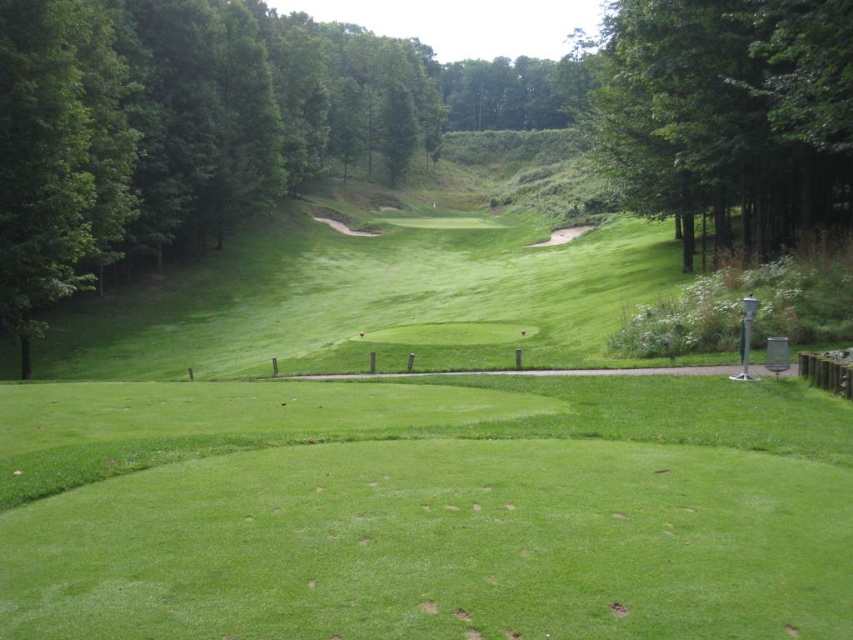
You are standing at the edge of the putting green and want to hit a golf ball to a point that is 30 meters away. Is the point at point (16, 92) within your target distance?

The point at point (16, 92) is 30.81 meters away from the viewer, so it is slightly beyond the 30 meter target distance.

You are a golfer standing at the tee box preparing to hit your ball. You notice two points marked on the golf course. The first is at point (x=126, y=218) and the second at point (x=682, y=179). Which point is closer to your current position?

Point (x=126, y=218) is further to the camera than point (x=682, y=179). Therefore, point (x=682, y=179) is closer to your current position.